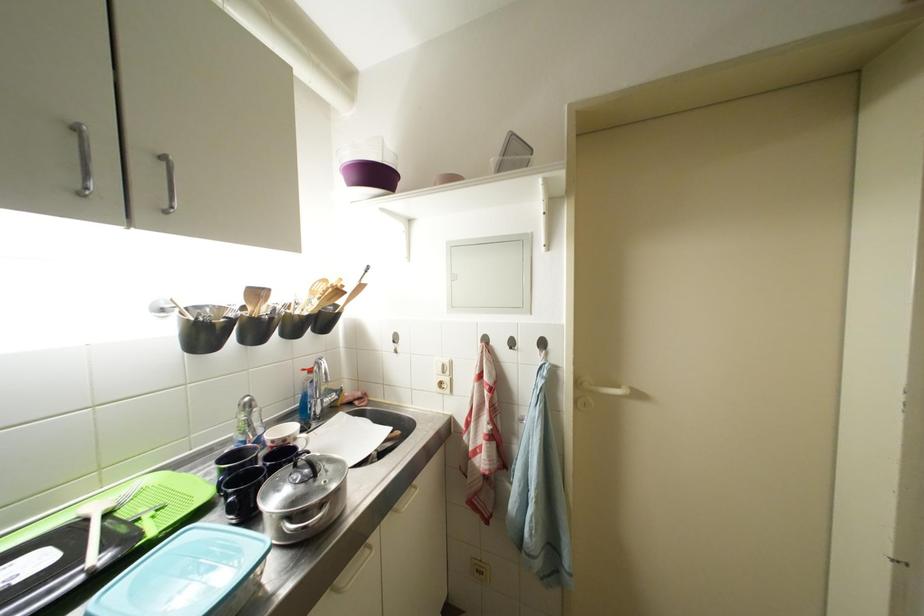
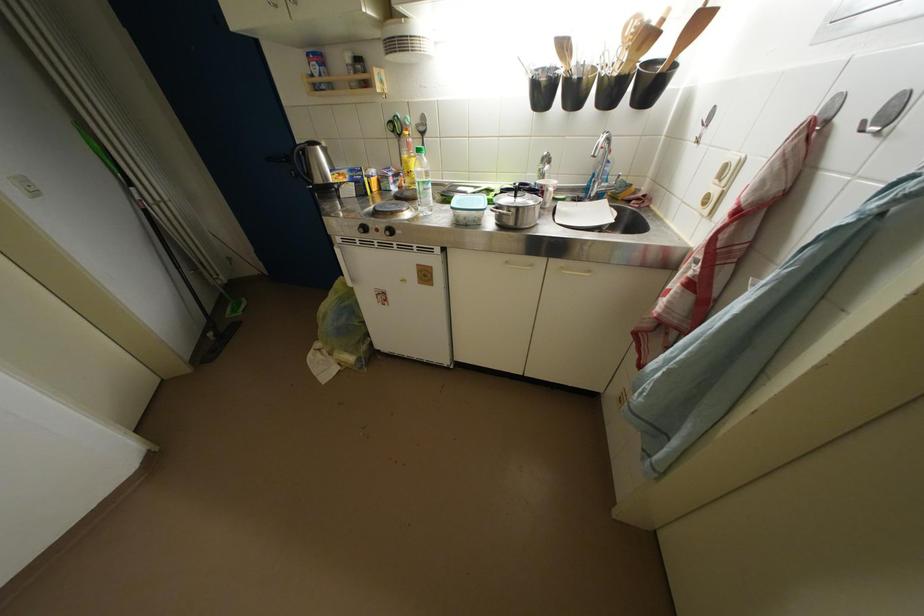
Locate, in the second image, the point that corresponds to the point at 114,519 in the first image.

(495, 193)